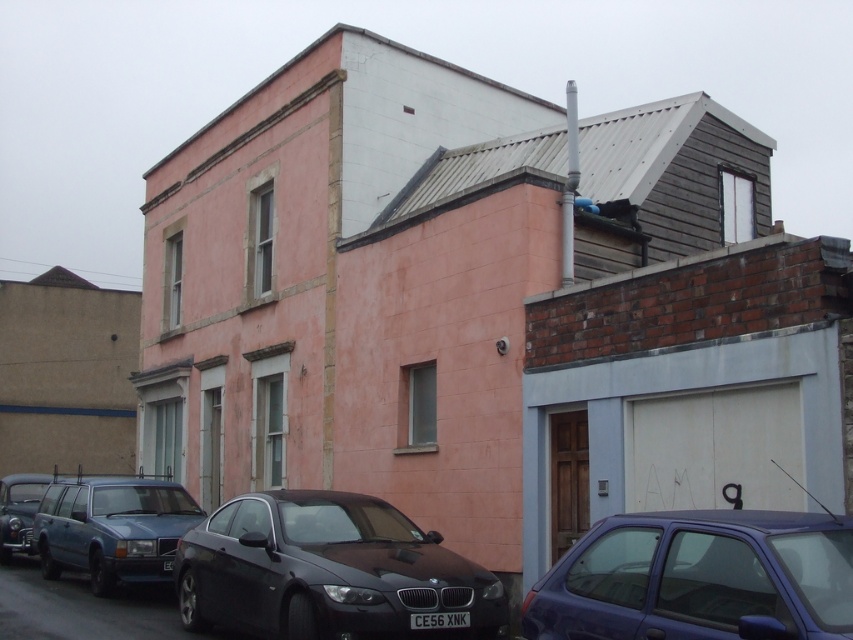
You are standing at point [328,572] in the image. What vehicle do you see there?

At point [328,572] lies shiny black sedan at center.

You are standing in front of the two story building and want to park your car. Is the shiny black sedan at center blocking the entrance to the garage?

The shiny black sedan at center is located at point [328,572], which is not near the entrance of the garage. Therefore, the shiny black sedan at center is not blocking the entrance to the garage.